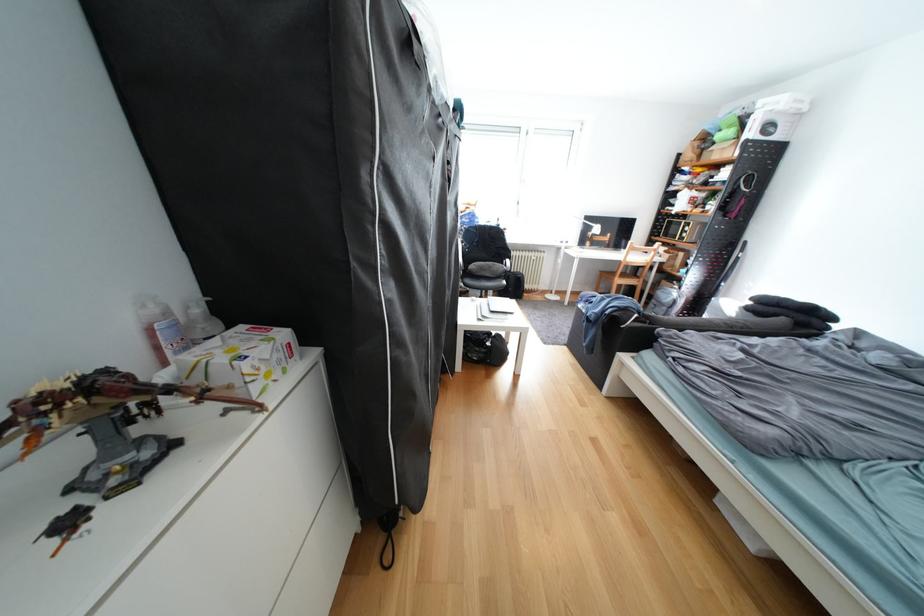
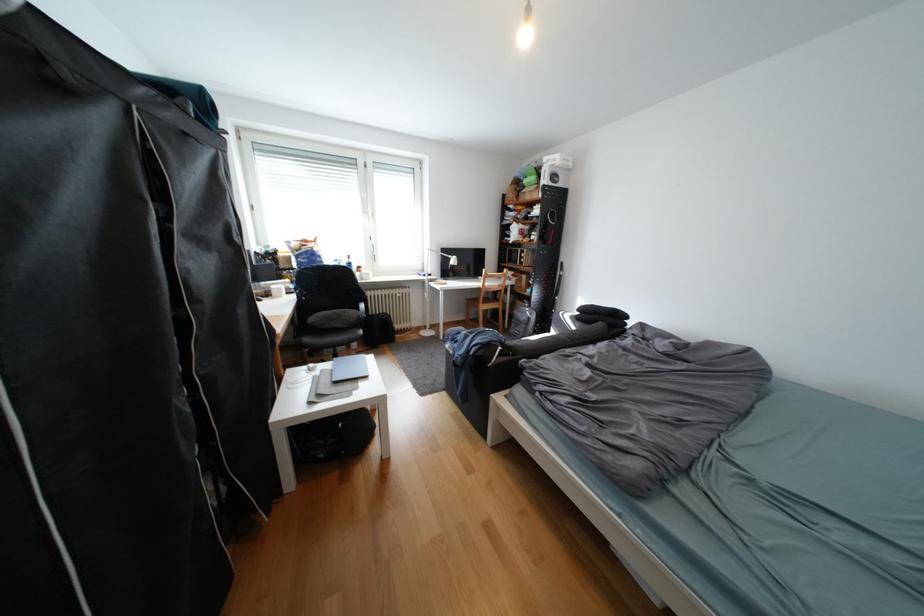
The images are taken continuously from a first-person perspective. In which direction are you moving?

The cameraman walked toward right, forward.